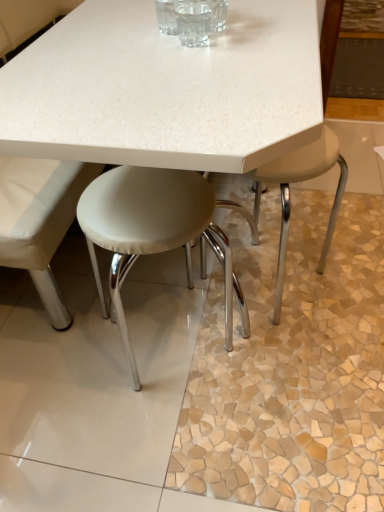
The height and width of the screenshot is (512, 384). Describe the element at coordinates (289, 195) in the screenshot. I see `beige leather stool at lower right, acting as the second stool starting from the left` at that location.

You are a GUI agent. You are given a task and a screenshot of the screen. Output one action in this format:
    pyautogui.click(x=<x>, y=<y>)
    Task: Click on the transparent glass at center
    
    Given the screenshot: What is the action you would take?
    pyautogui.click(x=193, y=22)

Would you say beige leather stool at lower right, arranged as the first stool when viewed from the right, is inside or outside transparent glass at center?

The correct answer is: outside.

Is beige leather stool at lower right, acting as the second stool starting from the left, aimed at transparent glass at center?

No, beige leather stool at lower right, acting as the second stool starting from the left, is not oriented towards transparent glass at center.

Consider the image. Which of these two, beige leather stool at lower right, arranged as the first stool when viewed from the right, or transparent glass at center, stands taller?

beige leather stool at lower right, arranged as the first stool when viewed from the right.

Measure the distance between beige leather stool at lower right, arranged as the first stool when viewed from the right, and transparent glass at center.

30.62 inches.

This screenshot has width=384, height=512. In order to click on clear in front of the beige leather stool at lower right, arranged as the first stool when viewed from the right in this screenshot , I will do `click(193, 22)`.

In the scene shown: How far apart are transparent glass at center and beige leather stool at lower right, arranged as the first stool when viewed from the right?

transparent glass at center and beige leather stool at lower right, arranged as the first stool when viewed from the right, are 77.77 centimeters apart.

Considering the positions of objects transparent glass at center and beige leather stool at lower right, arranged as the first stool when viewed from the right, in the image provided, who is more to the right, transparent glass at center or beige leather stool at lower right, arranged as the first stool when viewed from the right,?

Positioned to the right is beige leather stool at lower right, arranged as the first stool when viewed from the right.

From the picture: Is transparent glass at center completely or partially outside of beige leather stool at lower right, acting as the second stool starting from the left?

That's correct, transparent glass at center is outside of beige leather stool at lower right, acting as the second stool starting from the left.

Where is `clear behind the white leather stool at center, which is the 1th stool in left-to-right order`? This screenshot has height=512, width=384. clear behind the white leather stool at center, which is the 1th stool in left-to-right order is located at coordinates (193, 22).

Is there a large distance between white leather stool at center, marked as the 2th stool in a right-to-left arrangement, and transparent glass at center?

No.

Considering the positions of objects white leather stool at center, which is the 1th stool in left-to-right order, and transparent glass at center in the image provided, who is more to the left, white leather stool at center, which is the 1th stool in left-to-right order, or transparent glass at center?

white leather stool at center, which is the 1th stool in left-to-right order, is more to the left.

What's the angular difference between white leather stool at center, marked as the 2th stool in a right-to-left arrangement, and transparent glass at center's facing directions?

There is a 91.9-degree angle between the facing directions of white leather stool at center, marked as the 2th stool in a right-to-left arrangement, and transparent glass at center.

Is white leather stool at center, marked as the 2th stool in a right-to-left arrangement, taller or shorter than beige leather stool at lower right, arranged as the first stool when viewed from the right?

Clearly, white leather stool at center, marked as the 2th stool in a right-to-left arrangement, is taller compared to beige leather stool at lower right, arranged as the first stool when viewed from the right.

Is white leather stool at center, marked as the 2th stool in a right-to-left arrangement, turned away from beige leather stool at lower right, acting as the second stool starting from the left?

That's not correct — white leather stool at center, marked as the 2th stool in a right-to-left arrangement, is not looking away from beige leather stool at lower right, acting as the second stool starting from the left.

From the picture: Is white leather stool at center, which is the 1th stool in left-to-right order, bigger than beige leather stool at lower right, arranged as the first stool when viewed from the right?

Correct, white leather stool at center, which is the 1th stool in left-to-right order, is larger in size than beige leather stool at lower right, arranged as the first stool when viewed from the right.

At what (x,y) coordinates should I click in order to perform the action: click on stool that is under the white leather stool at center, which is the 1th stool in left-to-right order (from a real-world perspective). Please return your answer as a coordinate pair (x, y). Looking at the image, I should click on (289, 195).

Can you confirm if transparent glass at center is positioned to the right of white leather stool at center, marked as the 2th stool in a right-to-left arrangement?

Indeed, transparent glass at center is positioned on the right side of white leather stool at center, marked as the 2th stool in a right-to-left arrangement.

Would you say transparent glass at center is a long distance from white leather stool at center, marked as the 2th stool in a right-to-left arrangement?

transparent glass at center is near white leather stool at center, marked as the 2th stool in a right-to-left arrangement, not far away.

Is point (198, 42) positioned after point (204, 252)?

No, (198, 42) is in front of (204, 252).

Can we say transparent glass at center lies outside white leather stool at center, which is the 1th stool in left-to-right order?

Yes, transparent glass at center is outside of white leather stool at center, which is the 1th stool in left-to-right order.

Is beige leather stool at lower right, acting as the second stool starting from the left, facing away from white leather stool at center, which is the 1th stool in left-to-right order?

beige leather stool at lower right, acting as the second stool starting from the left, does not have its back to white leather stool at center, which is the 1th stool in left-to-right order.

How many degrees apart are the facing directions of beige leather stool at lower right, acting as the second stool starting from the left, and white leather stool at center, which is the 1th stool in left-to-right order?

The angular difference between beige leather stool at lower right, acting as the second stool starting from the left, and white leather stool at center, which is the 1th stool in left-to-right order, is 90 degrees.

From a real-world perspective, is beige leather stool at lower right, arranged as the first stool when viewed from the right, below white leather stool at center, marked as the 2th stool in a right-to-left arrangement?

Yes, from a real-world perspective, beige leather stool at lower right, arranged as the first stool when viewed from the right, is below white leather stool at center, marked as the 2th stool in a right-to-left arrangement.

Find the location of a particular element. clear lying in front of the beige leather stool at lower right, arranged as the first stool when viewed from the right is located at coordinates (193, 22).

Identify the location of clear above the beige leather stool at lower right, acting as the second stool starting from the left (from a real-world perspective). (193, 22).

Estimate the real-world distances between objects in this image. Which object is further from transparent glass at center, white leather stool at center, marked as the 2th stool in a right-to-left arrangement, or beige leather stool at lower right, acting as the second stool starting from the left?

beige leather stool at lower right, acting as the second stool starting from the left, is positioned further to the anchor transparent glass at center.

Based on the photo, from the image, which object appears to be nearer to beige leather stool at lower right, arranged as the first stool when viewed from the right, white leather stool at center, which is the 1th stool in left-to-right order, or transparent glass at center?

Among the two, white leather stool at center, which is the 1th stool in left-to-right order, is located nearer to beige leather stool at lower right, arranged as the first stool when viewed from the right.

Looking at the image, which one is located further to white leather stool at center, marked as the 2th stool in a right-to-left arrangement, beige leather stool at lower right, acting as the second stool starting from the left, or transparent glass at center?

beige leather stool at lower right, acting as the second stool starting from the left, is further to white leather stool at center, marked as the 2th stool in a right-to-left arrangement.

Based on their spatial positions, is transparent glass at center or beige leather stool at lower right, acting as the second stool starting from the left, closer to white leather stool at center, marked as the 2th stool in a right-to-left arrangement?

transparent glass at center.

Looking at the image, which one is located closer to beige leather stool at lower right, arranged as the first stool when viewed from the right, transparent glass at center or white leather stool at center, marked as the 2th stool in a right-to-left arrangement?

Based on the image, white leather stool at center, marked as the 2th stool in a right-to-left arrangement, appears to be nearer to beige leather stool at lower right, arranged as the first stool when viewed from the right.

Which object lies further to the anchor point transparent glass at center, beige leather stool at lower right, arranged as the first stool when viewed from the right, or white leather stool at center, which is the 1th stool in left-to-right order?

The object further to transparent glass at center is beige leather stool at lower right, arranged as the first stool when viewed from the right.

Locate an element on the screen. stool that lies between transparent glass at center and white leather stool at center, which is the 1th stool in left-to-right order, from top to bottom is located at coordinates (289, 195).